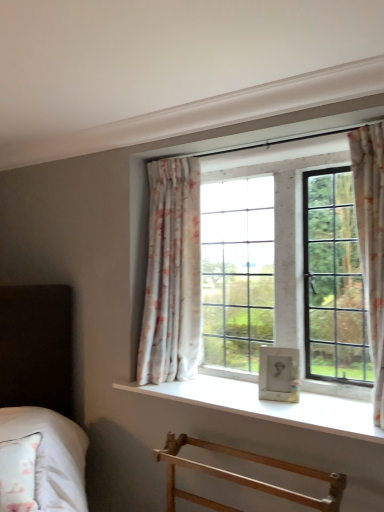
Question: In terms of height, does floral fabric curtain at upper center, positioned as the 1th curtain in back-to-front order, look taller or shorter compared to white smooth window sill at center?

Choices:
 (A) short
 (B) tall

Answer: (B)

Question: Is floral fabric curtain at upper center, placed as the second curtain when sorted from front to back, bigger or smaller than white smooth window sill at center?

Choices:
 (A) small
 (B) big

Answer: (B)

Question: Which object is positioned farthest from the white smooth window sill at center?

Choices:
 (A) floral fabric curtain at upper center, placed as the second curtain when sorted from front to back
 (B) floral fabric curtain at right, the 1th curtain from the front
 (C) light wood towel rack at lower center
 (D) white soft fabric bed at lower left

Answer: (D)

Question: Which of these objects is positioned farthest from the light wood towel rack at lower center?

Choices:
 (A) floral fabric curtain at upper center, placed as the second curtain when sorted from front to back
 (B) floral fabric curtain at right, which ranks as the first curtain in right-to-left order
 (C) white soft fabric bed at lower left
 (D) white smooth window sill at center

Answer: (B)